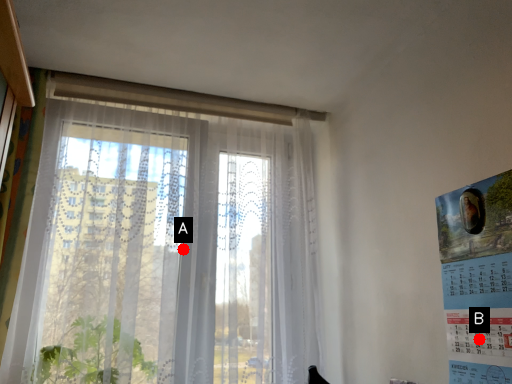
Question: Two points are circled on the image, labeled by A and B beside each circle. Which of the following is the closest to the observer?

Choices:
 (A) A is closer
 (B) B is closer

Answer: (B)